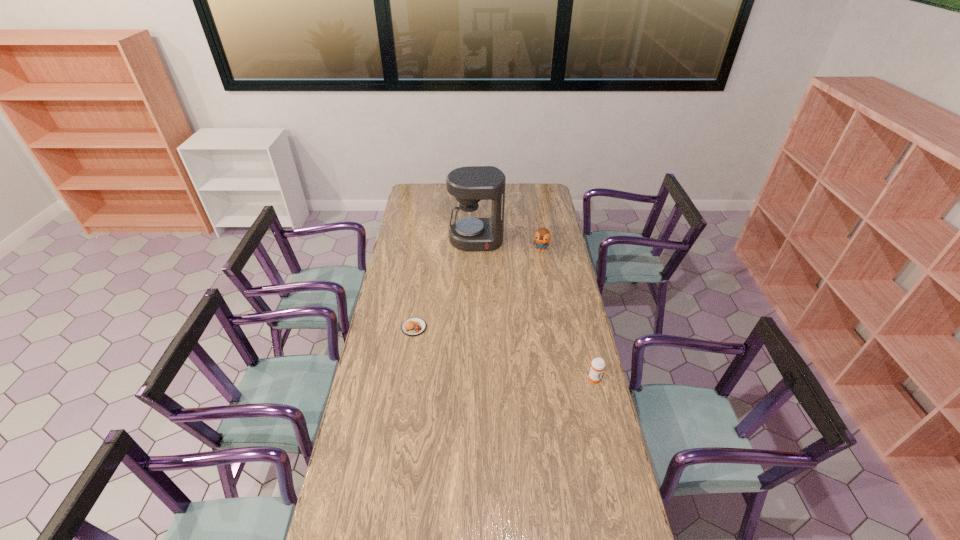
Find the location of a particular element. This screenshot has width=960, height=540. vacant space on the desktop that is between the leftmost object and the second shortest object and is positioned on the front-facing side of the duck is located at coordinates (498, 352).

This screenshot has width=960, height=540. Find the location of `vacant space on the desktop that is between the patty and the third tallest object and is positioned on the front-facing side of the tallest object`. vacant space on the desktop that is between the patty and the third tallest object and is positioned on the front-facing side of the tallest object is located at coordinates (482, 347).